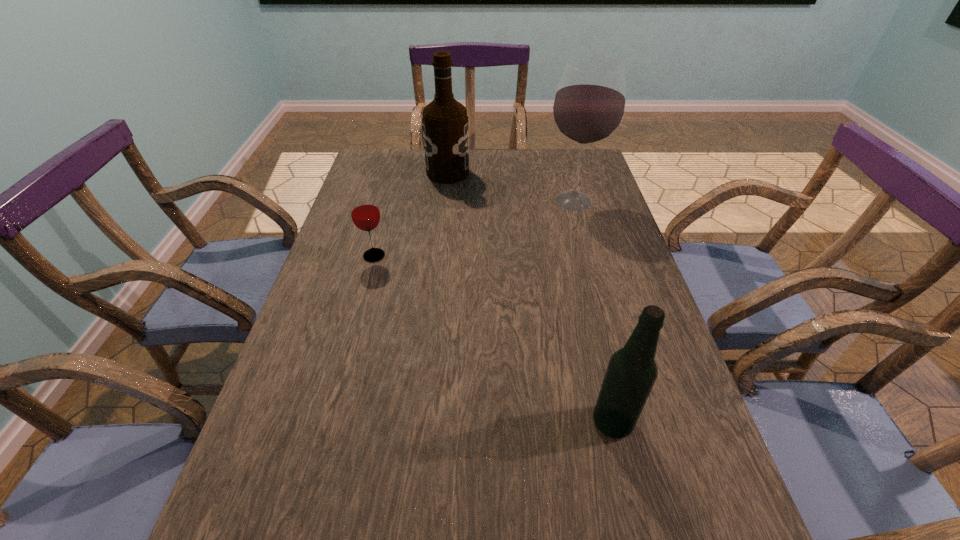
Image resolution: width=960 pixels, height=540 pixels. Identify the location of free space between the second object from left to right and the nearest object. (530, 298).

Find the location of `vacant region between the third object from right to left and the second farthest alcohol`. vacant region between the third object from right to left and the second farthest alcohol is located at coordinates (511, 187).

Locate an element on the screen. This screenshot has height=540, width=960. free point between the shortest alcohol and the farthest alcohol is located at coordinates (530, 298).

Image resolution: width=960 pixels, height=540 pixels. What are the coordinates of `free space that is in between the third object from right to left and the second farthest alcohol` in the screenshot? It's located at (511, 187).

The width and height of the screenshot is (960, 540). Identify the location of vacant area that lies between the third nearest object and the shortest object. (473, 228).

Find the location of a particular element. vacant area between the third farthest object and the third tallest object is located at coordinates (493, 339).

The image size is (960, 540). In order to click on free space between the nearest object and the farthest alcohol in this screenshot , I will do `click(530, 298)`.

The height and width of the screenshot is (540, 960). In order to click on empty space between the shortest object and the second farthest alcohol in this screenshot , I will do `click(473, 228)`.

Where is `object that is the third closest to the second farthest object`? object that is the third closest to the second farthest object is located at coordinates (631, 373).

Image resolution: width=960 pixels, height=540 pixels. In order to click on the closest object to the second nearest alcohol in this screenshot , I will do `click(445, 122)`.